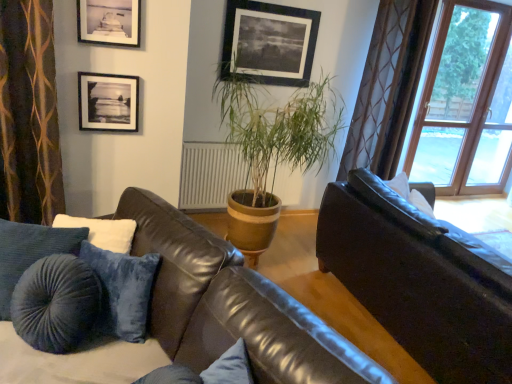
I want to click on transparent glass screen door at upper right, so click(495, 133).

Describe the element at coordinates (394, 204) in the screenshot. I see `white soft pillow at upper right` at that location.

Measure the distance between black matte picture frame at upper center, which is the third picture frame in bottom-to-top order, and camera.

The distance of black matte picture frame at upper center, which is the third picture frame in bottom-to-top order, from camera is 9.97 feet.

I want to click on transparent glass screen door at upper right, so click(495, 133).

Starting from the green leafy plant at center, which picture frame is the 2nd one behind? Please provide its 2D coordinates.

[(269, 42)]

Which is behind, green leafy plant at center or black matte picture frame at upper center, positioned as the first picture frame in top-to-bottom order?

black matte picture frame at upper center, positioned as the first picture frame in top-to-bottom order.

Who is bigger, green leafy plant at center or black matte picture frame at upper center, which is counted as the 3th picture frame, starting from the front?

With larger size is green leafy plant at center.

Consider the image. Could black matte picture frame at upper center, which is counted as the 3th picture frame, starting from the front, be considered to be inside green leafy plant at center?

No, black matte picture frame at upper center, which is counted as the 3th picture frame, starting from the front, is not surrounded by green leafy plant at center.

Is clear glass window at upper right at the left side of transparent glass screen door at upper right?

Yes.

From their relative heights in the image, would you say clear glass window at upper right is taller or shorter than transparent glass screen door at upper right?

In the image, clear glass window at upper right appears to be taller than transparent glass screen door at upper right.

Measure the distance between brown textured curtain at left and green leafy plant at center.

brown textured curtain at left is 1.32 meters away from green leafy plant at center.

Is brown textured curtain at left not close to green leafy plant at center?

Yes, brown textured curtain at left and green leafy plant at center are quite far apart.

Is brown textured curtain at left positioned before green leafy plant at center?

Yes.

Is brown textured curtain at left wider or thinner than green leafy plant at center?

brown textured curtain at left is thinner than green leafy plant at center.

Based on the photo, considering the relative sizes of leather couch at center, the first studio couch positioned from the left, and transparent glass screen door at upper right in the image provided, is leather couch at center, the first studio couch positioned from the left, wider than transparent glass screen door at upper right?

Indeed, leather couch at center, the first studio couch positioned from the left, has a greater width compared to transparent glass screen door at upper right.

Considering the relative sizes of leather couch at center, positioned as the 2th studio couch in right-to-left order, and transparent glass screen door at upper right in the image provided, is leather couch at center, positioned as the 2th studio couch in right-to-left order, taller than transparent glass screen door at upper right?

Incorrect, the height of leather couch at center, positioned as the 2th studio couch in right-to-left order, is not larger of that of transparent glass screen door at upper right.

Looking at this image, which object is positioned more to the left, leather couch at center, positioned as the 2th studio couch in right-to-left order, or transparent glass screen door at upper right?

leather couch at center, positioned as the 2th studio couch in right-to-left order.

Looking at this image, from the image's perspective, is leather couch at center, positioned as the 2th studio couch in right-to-left order, on top of transparent glass screen door at upper right?

No.

From the image's perspective, is white soft pillow at upper right above or below black matte picture frame at upper center, which ranks as the 1th picture frame in right-to-left order?

From the image's perspective, white soft pillow at upper right appears below black matte picture frame at upper center, which ranks as the 1th picture frame in right-to-left order.

Which object is positioned more to the left, white soft pillow at upper right or black matte picture frame at upper center, acting as the third picture frame starting from the left?

Positioned to the left is black matte picture frame at upper center, acting as the third picture frame starting from the left.

In the image, is white soft pillow at upper right positioned in front of or behind black matte picture frame at upper center, positioned as the first picture frame in top-to-bottom order?

Visually, white soft pillow at upper right is located in front of black matte picture frame at upper center, positioned as the first picture frame in top-to-bottom order.

Is black matte picture frame at upper center, which is the third picture frame in bottom-to-top order, surrounded by white soft pillow at upper right?

No, black matte picture frame at upper center, which is the third picture frame in bottom-to-top order, is not surrounded by white soft pillow at upper right.

Considering the relative sizes of white soft pillow at upper right and clear glass window at upper right in the image provided, is white soft pillow at upper right thinner than clear glass window at upper right?

Incorrect, the width of white soft pillow at upper right is not less than that of clear glass window at upper right.

From the image's perspective, between white soft pillow at upper right and clear glass window at upper right, which one is located above?

clear glass window at upper right.

Between point (360, 192) and point (445, 182), which one is positioned behind?

The point (445, 182) is behind.

Where is `picture frame that is below the matte black picture frame at upper left, which appears as the second picture frame when viewed from the top (from the image's perspective)`? picture frame that is below the matte black picture frame at upper left, which appears as the second picture frame when viewed from the top (from the image's perspective) is located at coordinates (108, 102).

Which of these two, black matte picture frame at upper left, the third picture frame positioned from the right, or matte black picture frame at upper left, the 1th picture frame positioned from the front, is bigger?

matte black picture frame at upper left, the 1th picture frame positioned from the front, is bigger.

From a real-world perspective, is black matte picture frame at upper left, the third picture frame positioned from the right, physically located above or below matte black picture frame at upper left, the second picture frame from the bottom?

black matte picture frame at upper left, the third picture frame positioned from the right, is below matte black picture frame at upper left, the second picture frame from the bottom.

Between black matte picture frame at upper left, marked as the second picture frame in a back-to-front arrangement, and matte black picture frame at upper left, the 3th picture frame when ordered from back to front, which one has smaller width?

Thinner between the two is black matte picture frame at upper left, marked as the second picture frame in a back-to-front arrangement.

Find the location of a particular element. Image resolution: width=512 pixels, height=384 pixels. the 3rd picture frame positioned above the green leafy plant at center (from the image's perspective) is located at coordinates (269, 42).

Where is `screen door located underneath the clear glass window at upper right (from a real-world perspective)`? The image size is (512, 384). screen door located underneath the clear glass window at upper right (from a real-world perspective) is located at coordinates (495, 133).

From the picture: Estimate the real-world distances between objects in this image. Which object is further from transparent glass screen door at upper right, clear glass window at upper right or matte black picture frame at upper left, the 3th picture frame when ordered from back to front?

matte black picture frame at upper left, the 3th picture frame when ordered from back to front, is further to transparent glass screen door at upper right.

Estimate the real-world distances between objects in this image. Which object is further from black matte picture frame at upper center, which is counted as the 3th picture frame, starting from the front, brown textured curtain at left or white soft pillow at upper right?

brown textured curtain at left.

From the image, which object appears to be nearer to clear glass window at upper right, black matte picture frame at upper center, which ranks as the 1th picture frame in right-to-left order, or green leafy plant at center?

black matte picture frame at upper center, which ranks as the 1th picture frame in right-to-left order, is positioned closer to the anchor clear glass window at upper right.

Based on their spatial positions, is leather couch at center, positioned as the 2th studio couch in right-to-left order, or black matte picture frame at upper center, which ranks as the 1th picture frame in right-to-left order, closer to shiny brown leather couch at right, the 2th studio couch positioned from the left?

The object closer to shiny brown leather couch at right, the 2th studio couch positioned from the left, is leather couch at center, positioned as the 2th studio couch in right-to-left order.

From the picture: Looking at the image, which one is located further to shiny brown leather couch at right, the 1th studio couch positioned from the right, leather couch at center, positioned as the 2th studio couch in right-to-left order, or matte black picture frame at upper left, the 2th picture frame viewed from the left?

matte black picture frame at upper left, the 2th picture frame viewed from the left, is further to shiny brown leather couch at right, the 1th studio couch positioned from the right.

Based on their spatial positions, is brown textured curtain at left or shiny brown leather couch at right, the 2th studio couch positioned from the left, further from leather couch at center, positioned as the 2th studio couch in right-to-left order?

Based on the image, shiny brown leather couch at right, the 2th studio couch positioned from the left, appears to be further to leather couch at center, positioned as the 2th studio couch in right-to-left order.

From the image, which object appears to be farther from green leafy plant at center, white soft pillow at upper right or leather couch at center, positioned as the 2th studio couch in right-to-left order?

The object further to green leafy plant at center is leather couch at center, positioned as the 2th studio couch in right-to-left order.

Which object lies further to the anchor point black matte picture frame at upper center, which is the third picture frame in bottom-to-top order, white soft pillow at upper right or black matte picture frame at upper left, marked as the second picture frame in a back-to-front arrangement?

Based on the image, white soft pillow at upper right appears to be further to black matte picture frame at upper center, which is the third picture frame in bottom-to-top order.

The width and height of the screenshot is (512, 384). What are the coordinates of `picture frame positioned between leather couch at center, the first studio couch positioned from the left, and black matte picture frame at upper left, marked as the second picture frame in a back-to-front arrangement, from near to far` in the screenshot? It's located at (109, 22).

Where is `studio couch positioned between leather couch at center, positioned as the 2th studio couch in right-to-left order, and white soft pillow at upper right from near to far`? The image size is (512, 384). studio couch positioned between leather couch at center, positioned as the 2th studio couch in right-to-left order, and white soft pillow at upper right from near to far is located at coordinates (420, 280).

Where is `picture frame between matte black picture frame at upper left, the 2th picture frame viewed from the left, and clear glass window at upper right from left to right`? The width and height of the screenshot is (512, 384). picture frame between matte black picture frame at upper left, the 2th picture frame viewed from the left, and clear glass window at upper right from left to right is located at coordinates (269, 42).

Where is `houseplant positioned between matte black picture frame at upper left, the second picture frame from the bottom, and black matte picture frame at upper center, which appears as the first picture frame when viewed from the back, from near to far`? This screenshot has width=512, height=384. houseplant positioned between matte black picture frame at upper left, the second picture frame from the bottom, and black matte picture frame at upper center, which appears as the first picture frame when viewed from the back, from near to far is located at coordinates (273, 149).